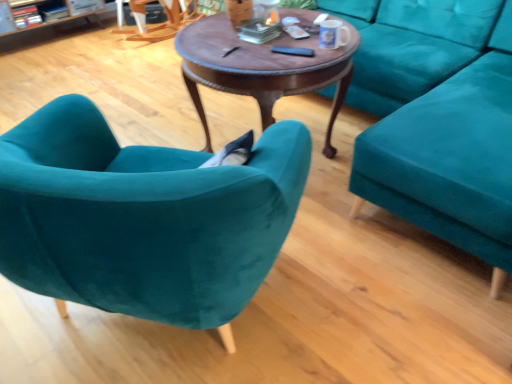
At what (x,y) coordinates should I click in order to perform the action: click on free space to the back side of black matte remote control at center, arranged as the first remote control when ordered from the bottom. Please return your answer as a coordinate pair (x, y). The image size is (512, 384). Looking at the image, I should click on (291, 46).